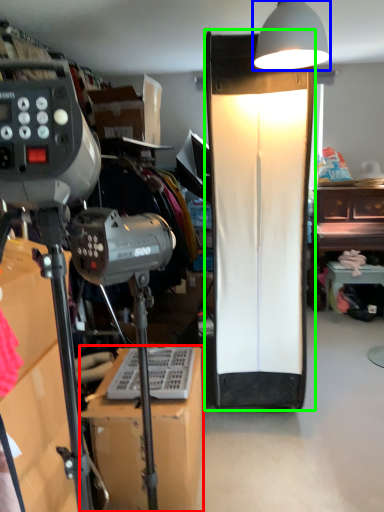
Question: Based on their relative distances, which object is nearer to furniture (highlighted by a red box)? Choose from lamp (highlighted by a blue box) and lamp (highlighted by a green box).

Choices:
 (A) lamp
 (B) lamp

Answer: (B)